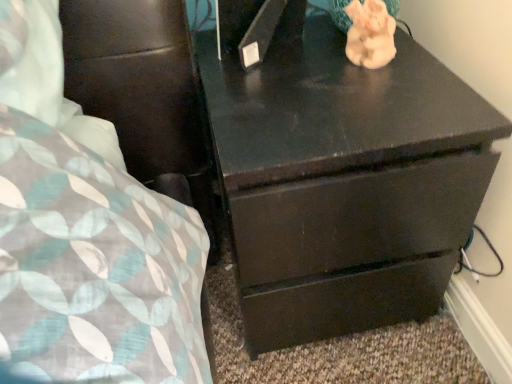
Question: Considering the positions of porcelain pink elephant at upper right and dark wood chest of drawers at center in the image, is porcelain pink elephant at upper right bigger or smaller than dark wood chest of drawers at center?

Choices:
 (A) big
 (B) small

Answer: (B)

Question: From the image's perspective, relative to dark wood chest of drawers at center, is porcelain pink elephant at upper right above or below?

Choices:
 (A) above
 (B) below

Answer: (A)

Question: Considering their positions, is porcelain pink elephant at upper right located in front of or behind dark wood chest of drawers at center?

Choices:
 (A) front
 (B) behind

Answer: (B)

Question: In terms of size, does dark wood chest of drawers at center appear bigger or smaller than porcelain pink elephant at upper right?

Choices:
 (A) small
 (B) big

Answer: (B)

Question: From the image's perspective, is dark wood chest of drawers at center located above or below porcelain pink elephant at upper right?

Choices:
 (A) below
 (B) above

Answer: (A)

Question: Based on their positions, is dark wood chest of drawers at center located to the left or right of porcelain pink elephant at upper right?

Choices:
 (A) right
 (B) left

Answer: (B)

Question: Relative to porcelain pink elephant at upper right, is dark wood chest of drawers at center in front or behind?

Choices:
 (A) behind
 (B) front

Answer: (B)